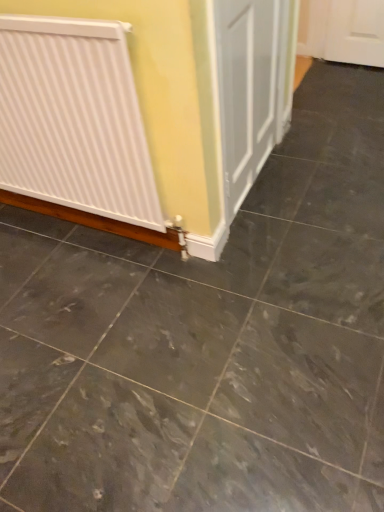
Image resolution: width=384 pixels, height=512 pixels. What are the coordinates of `gray marble floor at center` in the screenshot? It's located at (176, 382).

What is the approximate height of gray marble floor at center?

It is 1.16 inches.

What do you see at coordinates (176, 382) in the screenshot?
I see `gray marble floor at center` at bounding box center [176, 382].

What is the approximate height of white ribbed radiator at left?

It is 92.13 centimeters.

What do you see at coordinates (74, 119) in the screenshot? I see `white ribbed radiator at left` at bounding box center [74, 119].

At what (x,y) coordinates should I click in order to perform the action: click on white ribbed radiator at left. Please return your answer as a coordinate pair (x, y). This screenshot has width=384, height=512. Looking at the image, I should click on (74, 119).

Where is `gray marble floor at center`? gray marble floor at center is located at coordinates (176, 382).

Is gray marble floor at center to the right of white ribbed radiator at left from the viewer's perspective?

Indeed, gray marble floor at center is positioned on the right side of white ribbed radiator at left.

Considering the positions of objects gray marble floor at center and white ribbed radiator at left in the image provided, who is in front, gray marble floor at center or white ribbed radiator at left?

Positioned in front is gray marble floor at center.

Is point (12, 442) positioned behind point (47, 164)?

That is False.

From the image's perspective, who appears lower, gray marble floor at center or white ribbed radiator at left?

gray marble floor at center is shown below in the image.

From a real-world perspective, is gray marble floor at center physically located above or below white ribbed radiator at left?

From a real-world perspective, gray marble floor at center is physically below white ribbed radiator at left.

Which object is thinner, gray marble floor at center or white ribbed radiator at left?

white ribbed radiator at left is thinner.

Between gray marble floor at center and white ribbed radiator at left, which one has less height?

Standing shorter between the two is gray marble floor at center.

Is gray marble floor at center bigger or smaller than white ribbed radiator at left?

Considering their sizes, gray marble floor at center takes up less space than white ribbed radiator at left.

Is white ribbed radiator at left surrounded by gray marble floor at center?

No, white ribbed radiator at left is not surrounded by gray marble floor at center.

Would you consider gray marble floor at center to be distant from white ribbed radiator at left?

gray marble floor at center is actually quite close to white ribbed radiator at left.

Is gray marble floor at center facing towards white ribbed radiator at left?

Yes, gray marble floor at center is facing white ribbed radiator at left.

Measure the distance between gray marble floor at center and white ribbed radiator at left.

A distance of 23.01 inches exists between gray marble floor at center and white ribbed radiator at left.

This screenshot has width=384, height=512. In the image, there is a gray marble floor at center. What are the coordinates of `radiator above it (from the image's perspective)` in the screenshot? It's located at (74, 119).

Consider the image. Between white ribbed radiator at left and gray marble floor at center, which one appears on the right side from the viewer's perspective?

Positioned to the right is gray marble floor at center.

Consider the image. Between white ribbed radiator at left and gray marble floor at center, which one is positioned in front?

gray marble floor at center is closer to the camera.

Does point (71, 201) come closer to viewer compared to point (63, 239)?

Yes, point (71, 201) is closer to viewer.

From the picture: From the image's perspective, who appears lower, white ribbed radiator at left or gray marble floor at center?

gray marble floor at center, from the image's perspective.

From a real-world perspective, is white ribbed radiator at left on top of gray marble floor at center?

Correct, in the physical world, white ribbed radiator at left is higher than gray marble floor at center.

Does white ribbed radiator at left have a lesser width compared to gray marble floor at center?

Correct, the width of white ribbed radiator at left is less than that of gray marble floor at center.

From the picture: Can you confirm if white ribbed radiator at left is taller than gray marble floor at center?

Yes, white ribbed radiator at left is taller than gray marble floor at center.

Is white ribbed radiator at left bigger or smaller than gray marble floor at center?

Considering their sizes, white ribbed radiator at left takes up more space than gray marble floor at center.

Do you think white ribbed radiator at left is within gray marble floor at center, or outside of it?

white ribbed radiator at left cannot be found inside gray marble floor at center.

Are white ribbed radiator at left and gray marble floor at center far apart?

No, white ribbed radiator at left is not far from gray marble floor at center.

Is gray marble floor at center at the back of white ribbed radiator at left?

No, white ribbed radiator at left's orientation is not away from gray marble floor at center.

The height and width of the screenshot is (512, 384). What are the coordinates of `radiator behind the gray marble floor at center` in the screenshot? It's located at (74, 119).

Image resolution: width=384 pixels, height=512 pixels. In order to click on radiator above the gray marble floor at center (from a real-world perspective) in this screenshot , I will do `click(74, 119)`.

Where is `concrete in front of the white ribbed radiator at left`? The width and height of the screenshot is (384, 512). concrete in front of the white ribbed radiator at left is located at coordinates (176, 382).